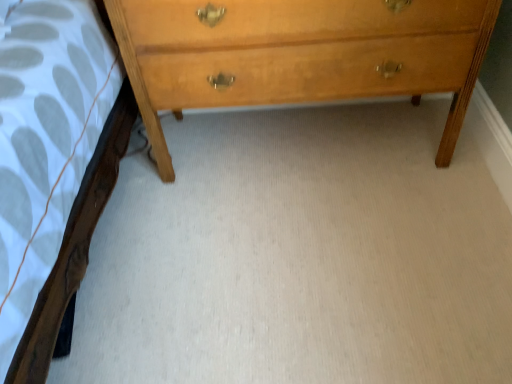
This screenshot has width=512, height=384. What do you see at coordinates (298, 55) in the screenshot? I see `light brown wood chest of drawers at upper center` at bounding box center [298, 55].

What is the approximate height of light brown wood chest of drawers at upper center?

The height of light brown wood chest of drawers at upper center is 62.85 centimeters.

Locate an element on the screen. Image resolution: width=512 pixels, height=384 pixels. light brown wood chest of drawers at upper center is located at coordinates [x=298, y=55].

What is the approximate width of light brown wood chest of drawers at upper center?

The width of light brown wood chest of drawers at upper center is 17.21 inches.

At what (x,y) coordinates should I click in order to perform the action: click on light brown wood chest of drawers at upper center. Please return your answer as a coordinate pair (x, y). The height and width of the screenshot is (384, 512). Looking at the image, I should click on (298, 55).